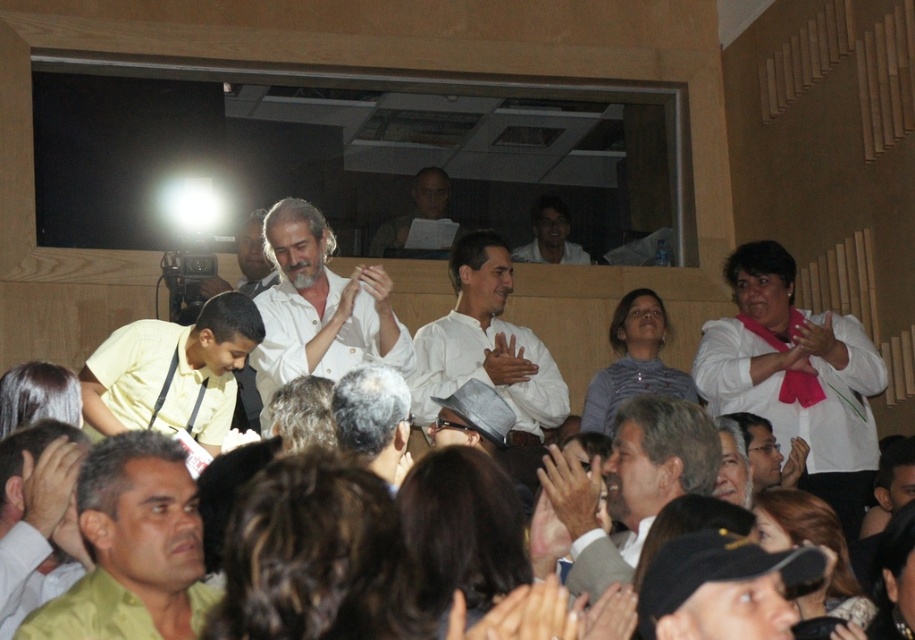
Question: Which point appears farthest from the camera in this image?

Choices:
 (A) (327, 374)
 (B) (368, 384)

Answer: (A)

Question: Does light brown leather jacket at center have a lesser width compared to white shirt at upper center?

Choices:
 (A) no
 (B) yes

Answer: (A)

Question: Can you confirm if yellow matte shirt at left is positioned to the left of white shirt at upper center?

Choices:
 (A) no
 (B) yes

Answer: (B)

Question: Which point is closer to the camera?

Choices:
 (A) (533, 225)
 (B) (268, 317)
 (C) (594, 500)
 (D) (378, 365)

Answer: (C)

Question: Can you confirm if gray hair at center is positioned to the left of white shirt at upper center?

Choices:
 (A) no
 (B) yes

Answer: (B)

Question: Which of the following is the closest to the observer?

Choices:
 (A) yellow matte shirt at left
 (B) matte yellow shirt at lower left

Answer: (B)